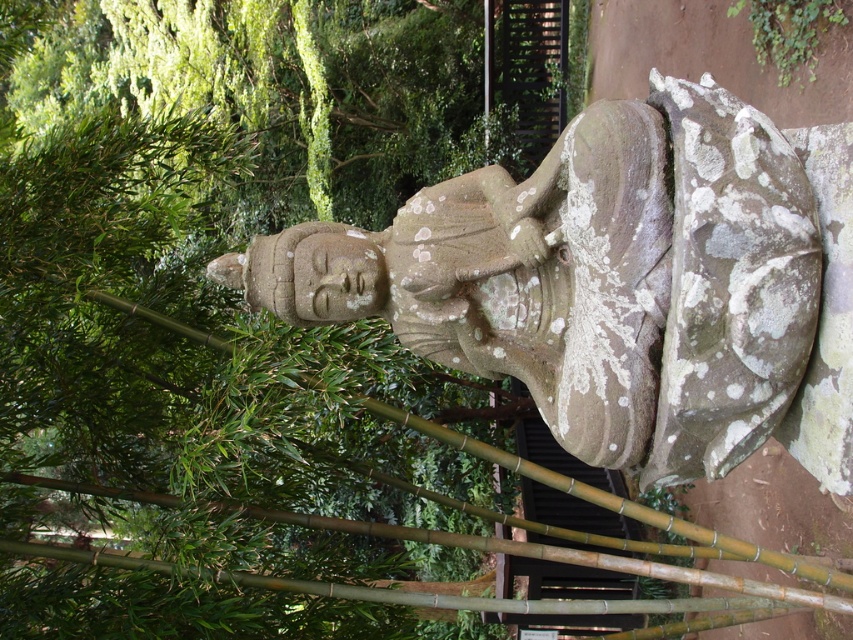
How distant is green bamboo at center from green mossy vine at upper right?

green bamboo at center and green mossy vine at upper right are 3.15 meters apart from each other.

Between point (206, 552) and point (759, 58), which one is positioned in front?

Positioned in front is point (206, 552).

Which is behind, point (473, 164) or point (805, 1)?

Positioned behind is point (473, 164).

You are a GUI agent. You are given a task and a screenshot of the screen. Output one action in this format:
    pyautogui.click(x=<x>, y=<y>)
    Task: Click on the green bamboo at center
    The image size is (853, 640).
    Given the screenshot: What is the action you would take?
    pyautogui.click(x=151, y=268)

Does point (730, 452) lie behind point (785, 13)?

No.

Does point (560, 413) come closer to viewer compared to point (804, 64)?

That is True.

Where is `stone statue at center`? Image resolution: width=853 pixels, height=640 pixels. stone statue at center is located at coordinates (614, 284).

Can you confirm if green bamboo at center is smaller than stone statue at center?

Correct, green bamboo at center occupies less space than stone statue at center.

Which is in front, point (102, 340) or point (592, 316)?

Positioned in front is point (592, 316).

Does point (109, 236) lie in front of point (722, 253)?

No, it is not.

In order to click on green bamboo at center in this screenshot , I will do `click(151, 268)`.